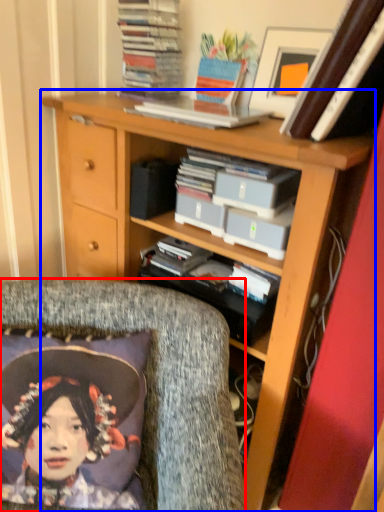
Question: Which point is closer to the camera, chair (highlighted by a red box) or bookcase (highlighted by a blue box)?

Choices:
 (A) chair
 (B) bookcase

Answer: (A)